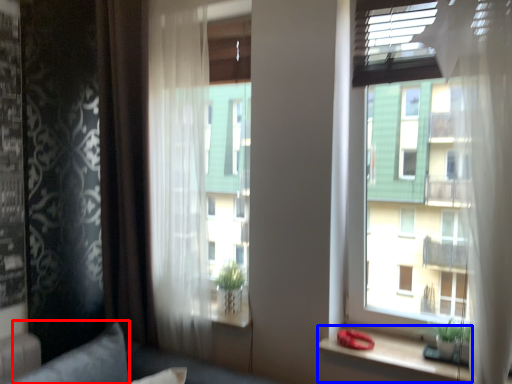
Question: Which of the following is the closest to the observer, pillow (highlighted by a red box) or window sill (highlighted by a blue box)?

Choices:
 (A) pillow
 (B) window sill

Answer: (A)